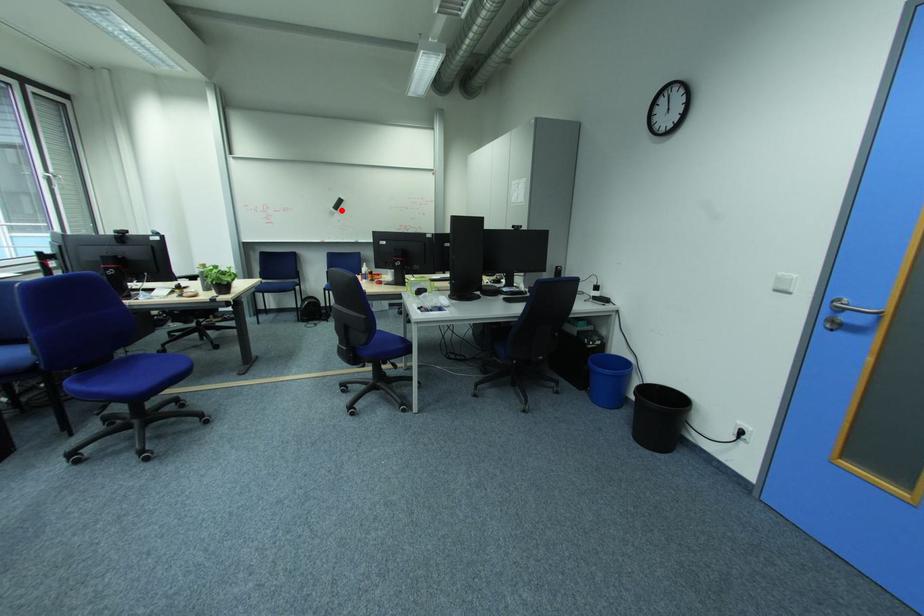
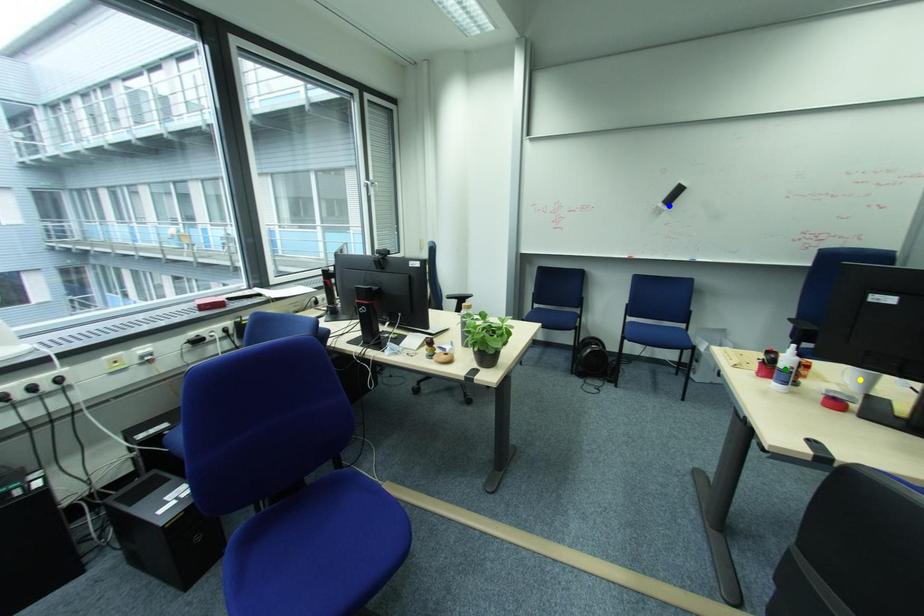
Question: I am providing you with two images of the same scene from different viewpoints. A red point is marked on the first image. You are given multiple points on the second image. In image 2, which mark is for the same physical point as the one in image 1?

Choices:
 (A) blue point
 (B) yellow point
 (C) green point

Answer: (A)